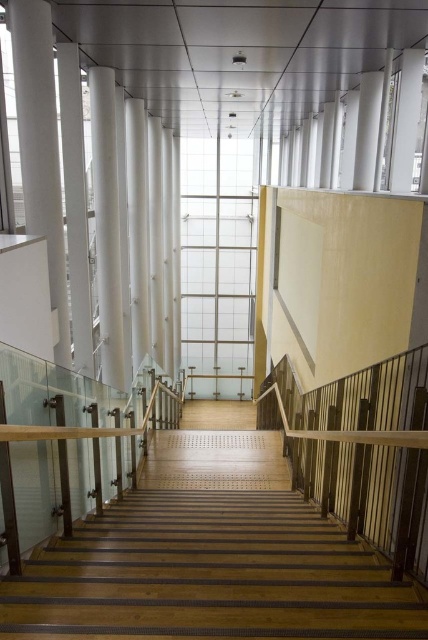
Question: Which object is the farthest from the white glossy pillar at left?

Choices:
 (A) white glossy pillar at center
 (B) wooden stairs at center
 (C) wooden at right

Answer: (C)

Question: Can you confirm if wooden stairs at center is bigger than wooden at right?

Choices:
 (A) yes
 (B) no

Answer: (A)

Question: Is wooden at right thinner than white glossy pillar at center?

Choices:
 (A) yes
 (B) no

Answer: (A)

Question: Among these points, which one is nearest to the camera?

Choices:
 (A) (55, 234)
 (B) (379, 419)
 (C) (282, 536)

Answer: (B)

Question: Which object is the farthest from the white glossy pillar at left?

Choices:
 (A) white glossy pillar at center
 (B) wooden stairs at center
 (C) wooden at right

Answer: (C)

Question: Does wooden at right have a lesser width compared to white glossy pillar at left?

Choices:
 (A) yes
 (B) no

Answer: (A)